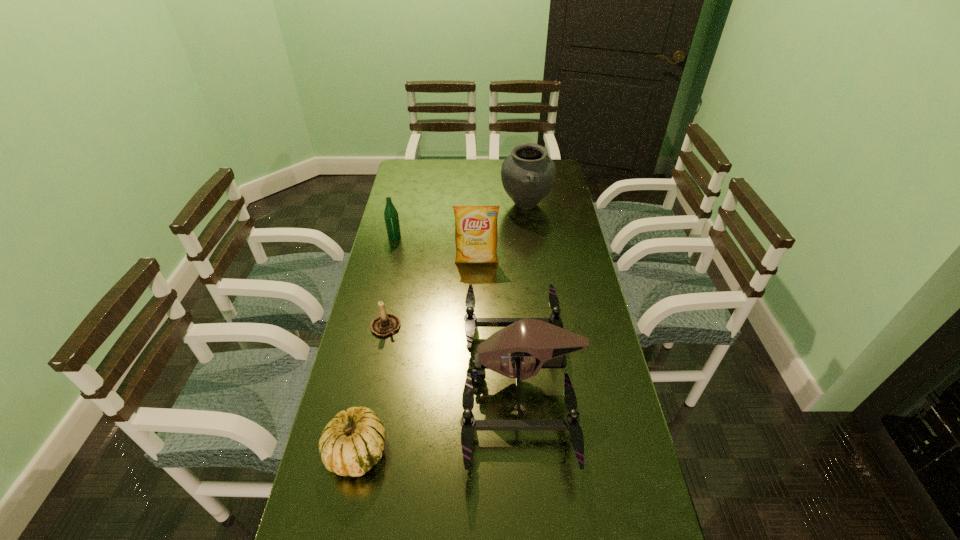
I want to click on the farthest object, so click(x=528, y=174).

I want to click on the fourth nearest object, so click(476, 236).

Find the location of a particular element. drone is located at coordinates (525, 345).

The width and height of the screenshot is (960, 540). I want to click on the third shortest object, so click(x=391, y=217).

Image resolution: width=960 pixels, height=540 pixels. In order to click on bottle in this screenshot , I will do `click(391, 217)`.

This screenshot has height=540, width=960. In order to click on gourd in this screenshot , I will do click(351, 443).

At what (x,y) coordinates should I click in order to perform the action: click on candle holder. Please return your answer as a coordinate pair (x, y). Looking at the image, I should click on (386, 324).

In order to click on free space located 0.300m on the left of the urn in this screenshot , I will do `click(430, 205)`.

Where is `free space located 0.070m on the front-facing side of the fourth nearest object`? This screenshot has width=960, height=540. free space located 0.070m on the front-facing side of the fourth nearest object is located at coordinates pos(476,282).

At what (x,y) coordinates should I click in order to perform the action: click on vacant space located 0.180m on the front-facing side of the drone. Please return your answer as a coordinate pair (x, y). The width and height of the screenshot is (960, 540). Looking at the image, I should click on (399, 379).